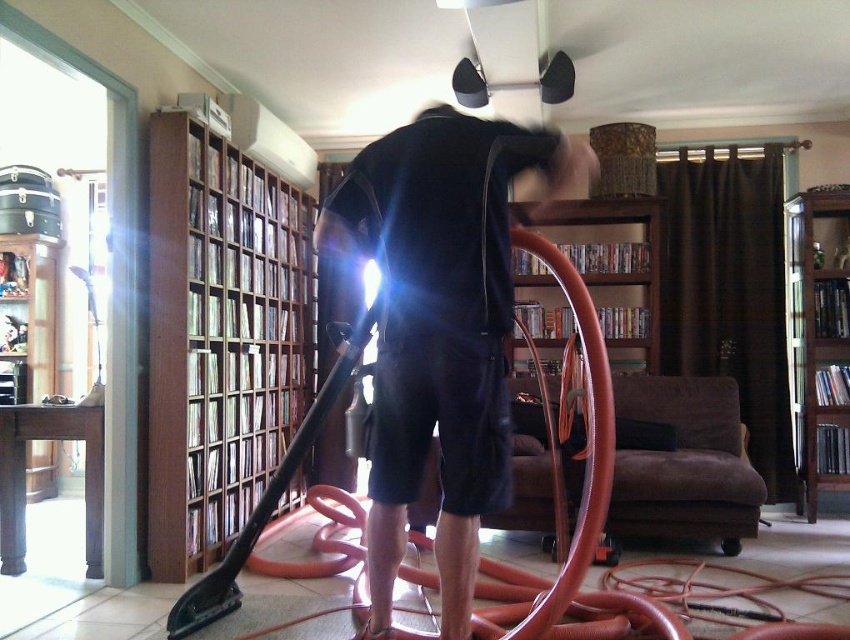
You are a cleaning robot that needs to move from the wooden bookshelf at left to the dark blue fabric shirt at center. Can you reach the shirt without moving the bookshelf?

The dark blue fabric shirt at center is 3.87 meters away from the wooden bookshelf at left, so yes, the robot can reach the shirt without moving the bookshelf since the distance is sufficient.

You are standing at point (x=649, y=212) and want to move to point (x=848, y=307). Is the path between these two points clear of any obstacles?

The path between point (x=848, y=307) and point (x=649, y=212) is clear since point (x=848, y=307) is in front of point (x=649, y=212), indicating no obstacles between them.